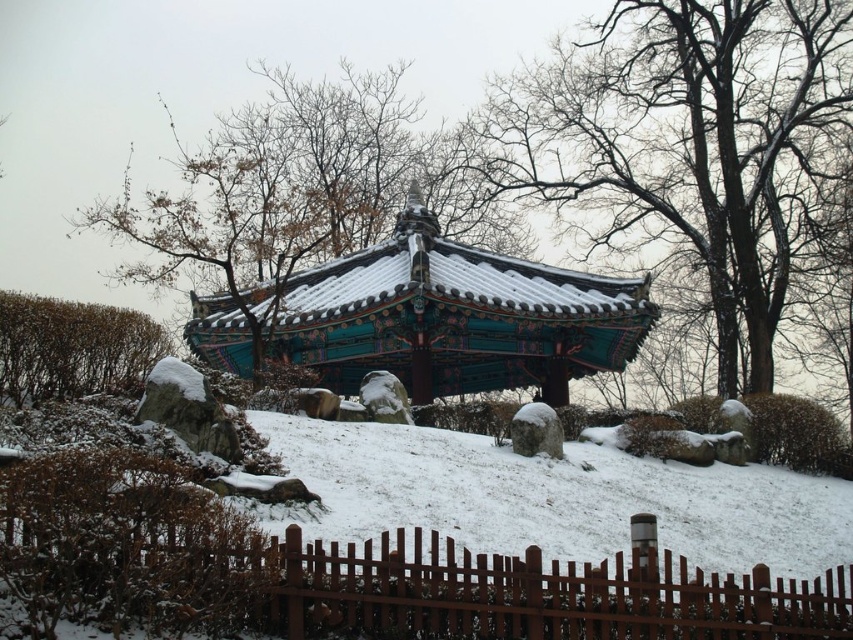
Is green wooden pavilion at center to the left of green leafy bush at left from the viewer's perspective?

No, green wooden pavilion at center is not to the left of green leafy bush at left.

Is green wooden pavilion at center above green leafy bush at left?

Yes, green wooden pavilion at center is above green leafy bush at left.

The image size is (853, 640). Find the location of `green wooden pavilion at center`. green wooden pavilion at center is located at coordinates (683, 140).

Locate an element on the screen. This screenshot has width=853, height=640. green wooden pavilion at center is located at coordinates (683, 140).

Does green wooden pavilion at center appear on the right side of brown wooden fence at lower center?

Correct, you'll find green wooden pavilion at center to the right of brown wooden fence at lower center.

The width and height of the screenshot is (853, 640). What are the coordinates of `green wooden pavilion at center` in the screenshot? It's located at (683, 140).

Based on the photo, does brown wooden fence at lower center come in front of teal wooden pavilion at center?

Yes, it is in front of teal wooden pavilion at center.

Who is positioned more to the left, brown wooden fence at lower center or teal wooden pavilion at center?

teal wooden pavilion at center is more to the left.

Describe the element at coordinates (421, 588) in the screenshot. I see `brown wooden fence at lower center` at that location.

You are a GUI agent. You are given a task and a screenshot of the screen. Output one action in this format:
    pyautogui.click(x=<x>, y=<y>)
    Task: Click on the brown wooden fence at lower center
    Image resolution: width=853 pixels, height=640 pixels.
    Given the screenshot: What is the action you would take?
    pyautogui.click(x=421, y=588)